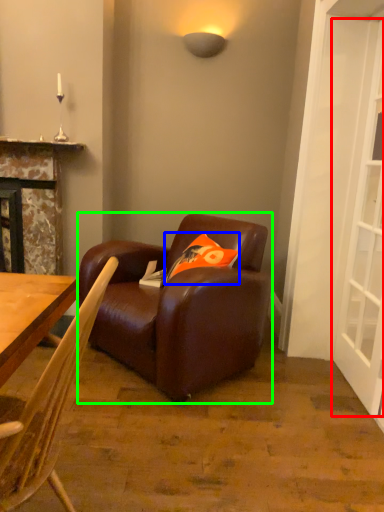
Question: Based on their relative distances, which object is farther from screen door (highlighted by a red box)? Choose from pillow (highlighted by a blue box) and studio couch (highlighted by a green box).

Choices:
 (A) pillow
 (B) studio couch

Answer: (B)